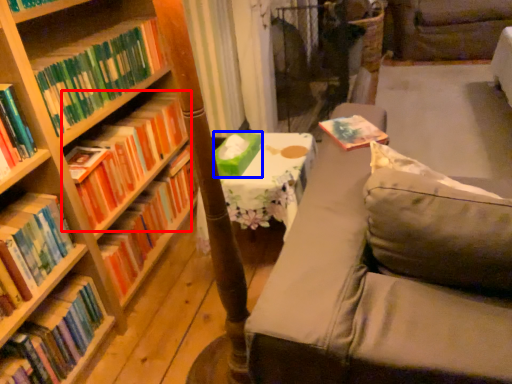
Question: Which point is closer to the camera, book (highlighted by a red box) or paperback book (highlighted by a blue box)?

Choices:
 (A) book
 (B) paperback book

Answer: (A)